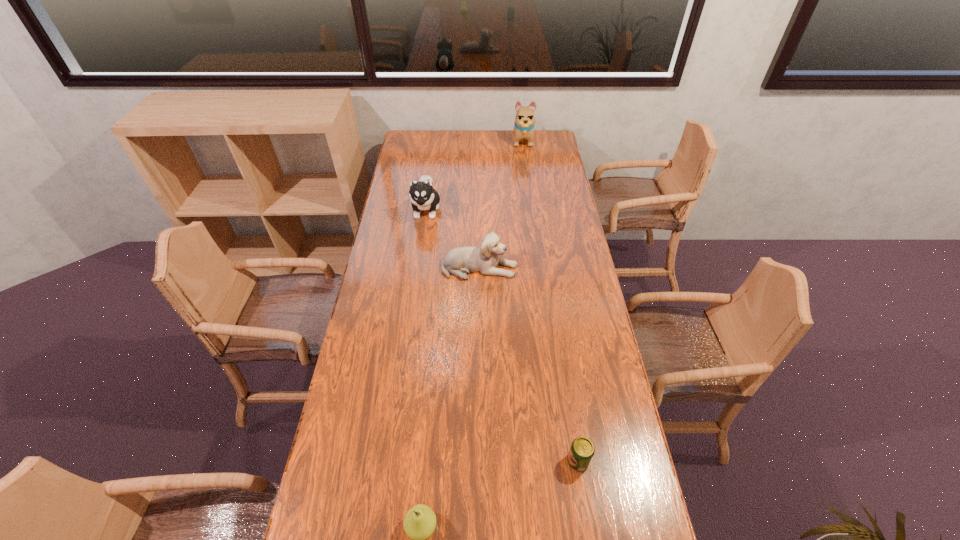
Image resolution: width=960 pixels, height=540 pixels. What are the coordinates of `free space at the far right corner of the desktop` in the screenshot? It's located at (555, 147).

The width and height of the screenshot is (960, 540). I want to click on free spot between the second nearest object and the second tallest object, so click(502, 335).

You are a GUI agent. You are given a task and a screenshot of the screen. Output one action in this format:
    pyautogui.click(x=<x>, y=<y>)
    Task: Click on the vacant area that lies between the tallest object and the second farthest puppy
    This screenshot has height=540, width=960.
    Given the screenshot: What is the action you would take?
    pyautogui.click(x=474, y=175)

The width and height of the screenshot is (960, 540). Find the location of `empty space between the shortest object and the tallest puppy`. empty space between the shortest object and the tallest puppy is located at coordinates tap(550, 301).

This screenshot has width=960, height=540. What are the coordinates of `blank region between the beer can and the tallest puppy` in the screenshot? It's located at [550, 301].

You are a GUI agent. You are given a task and a screenshot of the screen. Output one action in this format:
    pyautogui.click(x=<x>, y=<y>)
    Task: Click on the unoccupied area between the beer can and the farthest puppy
    The image size is (960, 540).
    Given the screenshot: What is the action you would take?
    point(550,301)

At what (x,y) coordinates should I click in order to perform the action: click on the fourth closest object to the nearest object. Please return your answer as a coordinate pair (x, y). This screenshot has width=960, height=540. Looking at the image, I should click on (524, 123).

You are a GUI agent. You are given a task and a screenshot of the screen. Output one action in this format:
    pyautogui.click(x=<x>, y=<y>)
    Task: Click on the second closest object to the fourth nearest object
    The width and height of the screenshot is (960, 540).
    Given the screenshot: What is the action you would take?
    pyautogui.click(x=524, y=123)

What are the coordinates of `the closest puppy to the tallest puppy` in the screenshot? It's located at (423, 196).

Where is `puppy that is the second closest to the third nearest object`? The width and height of the screenshot is (960, 540). puppy that is the second closest to the third nearest object is located at coordinates (524, 123).